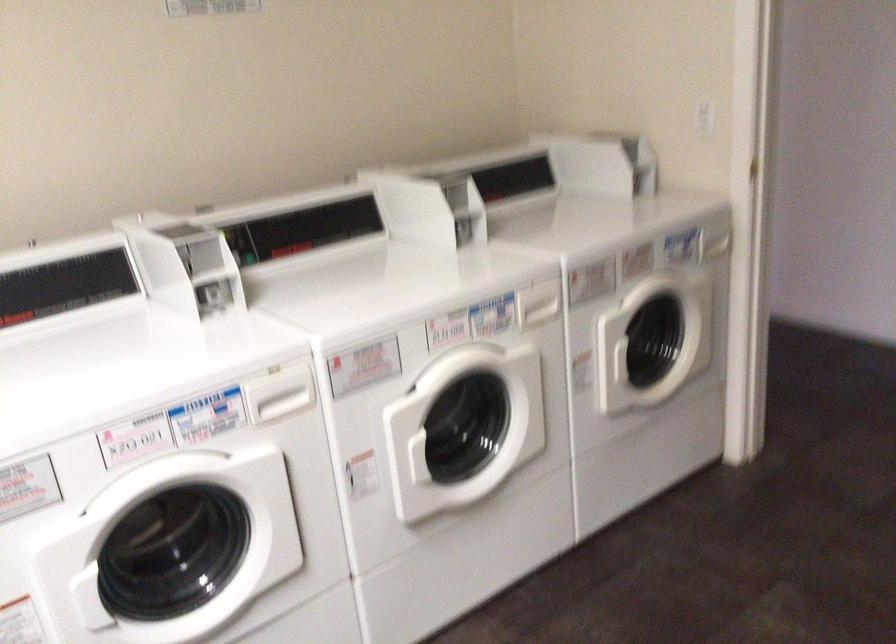
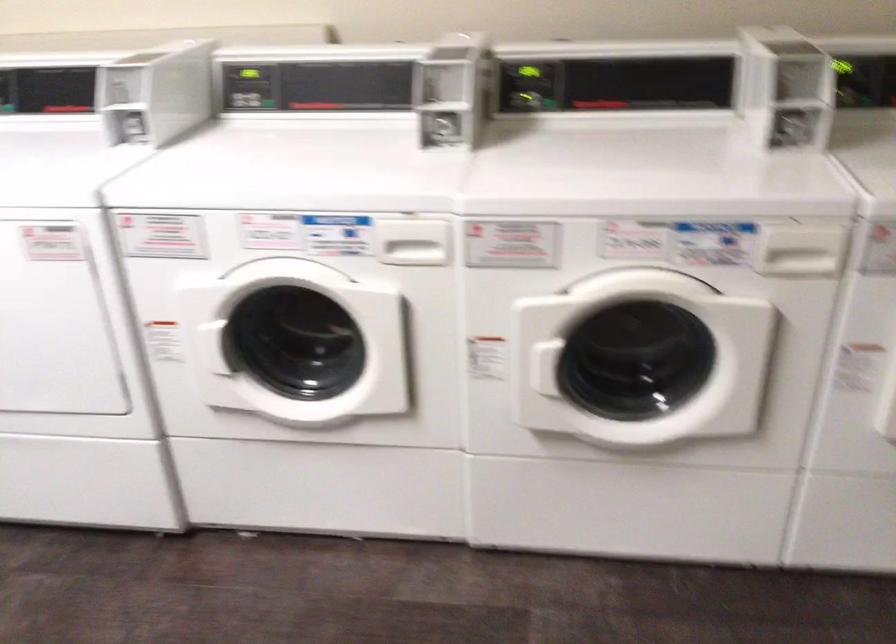
Locate, in the second image, the point that corresponds to point (297, 230) in the first image.

(613, 82)